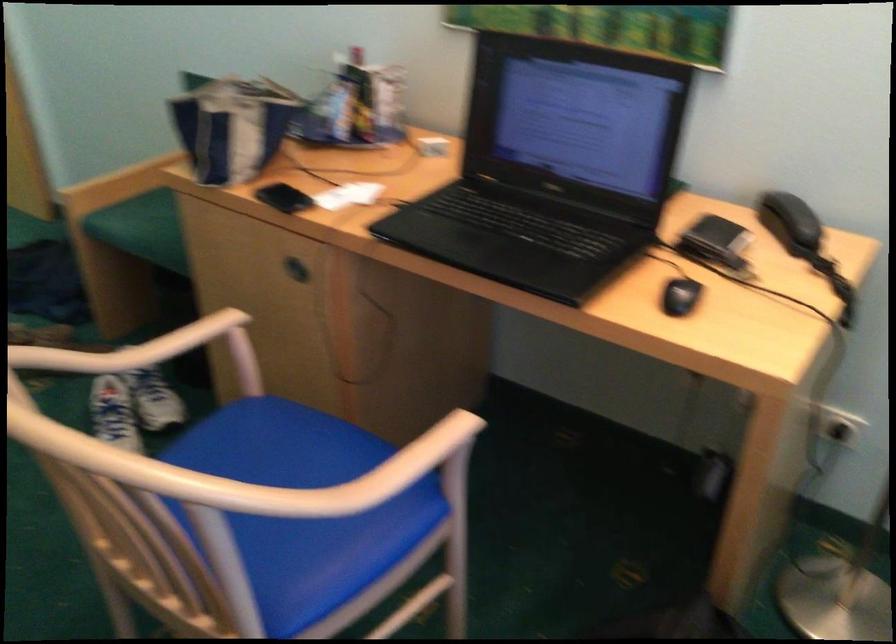
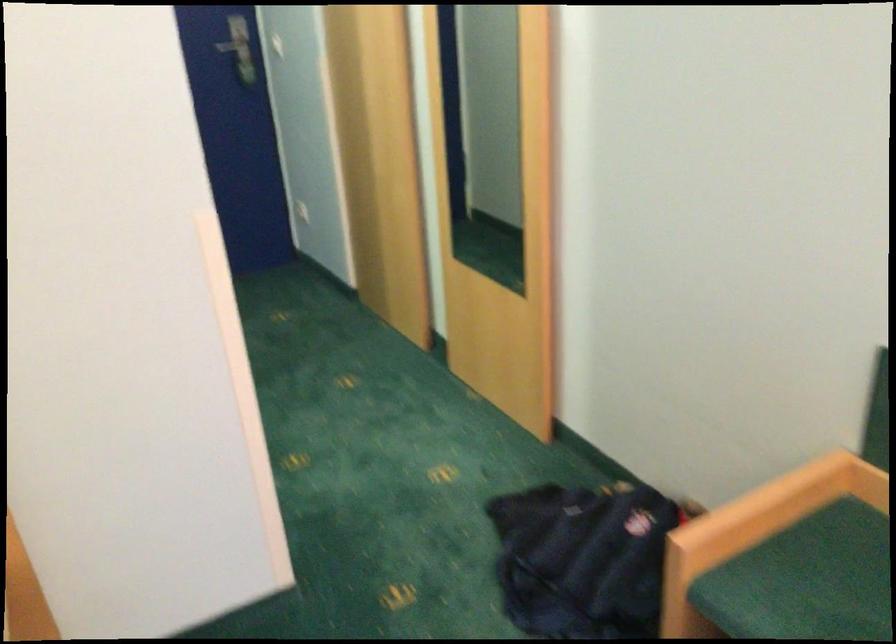
In the second image, find the point that corresponds to pixel 128 194 in the first image.

(756, 529)